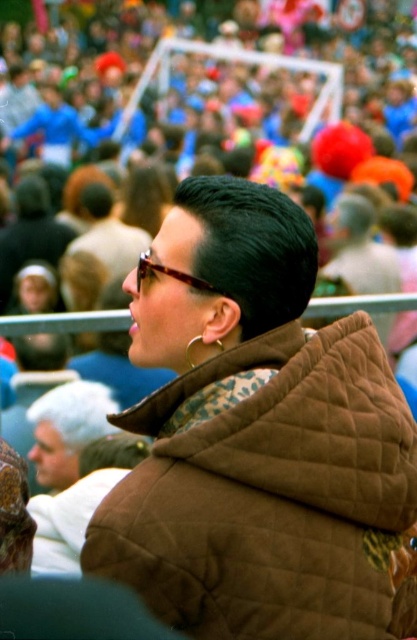
You are a photographer standing at the edge of the crowd, wanting to take a photo of the tortoiseshell glasses at center without the light brown leather jacket at lower left blocking it. Can you adjust your position to achieve this?

The light brown leather jacket at lower left is closer to you than the tortoiseshell glasses at center, so moving your position slightly to the right or left might allow you to angle around the jacket and capture the glasses without obstruction.

You are standing at the center of the image and want to find the light brown leather jacket at lower left. In which direction should you look?

You should look to the lower left direction to find the light brown leather jacket at lower left as it is located at point (67, 428).

You are taking a photo of the crowd at the event. You want to focus on the person in the foreground wearing the brown quilted jacket. Which point, point (238, 253) or point (65, 481), is closer to the camera and should be the focus point for the jacket?

Point (238, 253) is closer to the camera than point (65, 481), so you should focus on point (238, 253) to capture the person in the foreground wearing the brown quilted jacket clearly.